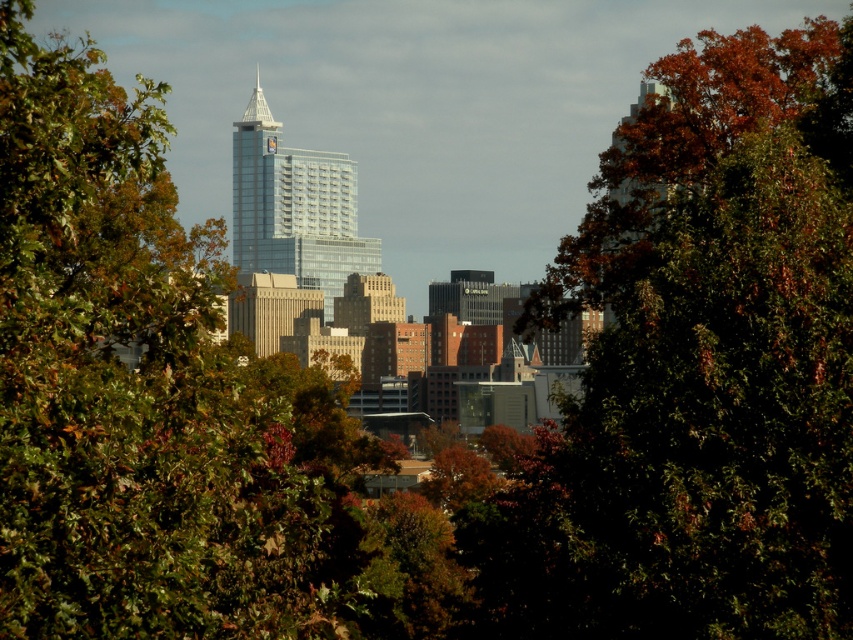
Question: Considering the real-world distances, which object is farthest from the autumn leaves at center?

Choices:
 (A) transparent glass skyscraper at center
 (B) green leafy tree at center

Answer: (B)

Question: Is autumn leaves at center positioned in front of transparent glass skyscraper at center?

Choices:
 (A) no
 (B) yes

Answer: (A)

Question: From the image, what is the correct spatial relationship of autumn leaves at center in relation to transparent glass skyscraper at center?

Choices:
 (A) below
 (B) above

Answer: (A)

Question: Does autumn leaves at center have a larger size compared to green leafy tree at center?

Choices:
 (A) yes
 (B) no

Answer: (B)

Question: Among these points, which one is farthest from the camera?

Choices:
 (A) (762, 179)
 (B) (323, 232)

Answer: (A)

Question: Which point is farther to the camera?

Choices:
 (A) transparent glass skyscraper at center
 (B) autumn leaves at center
 (C) green leafy tree at center

Answer: (B)